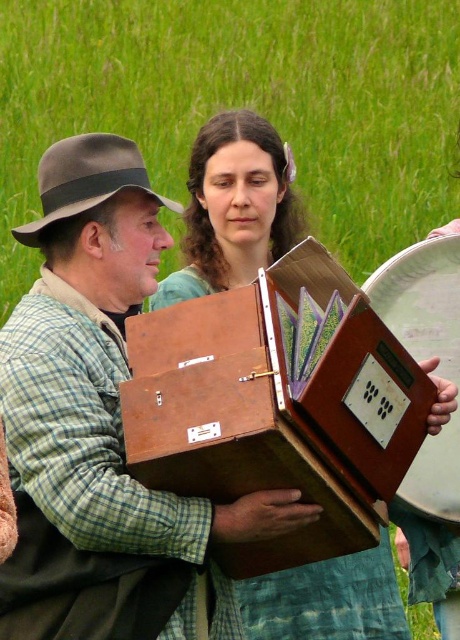
Between point (354, 314) and point (367, 289), which one is positioned behind?

The point (367, 289) is behind.

Between wooden accordion at center and wooden box at center, which one has less height?

Standing shorter between the two is wooden box at center.

Does point (151, 326) lie behind point (450, 305)?

No, (151, 326) is in front of (450, 305).

Find the location of a particular element. The image size is (460, 640). wooden accordion at center is located at coordinates (276, 404).